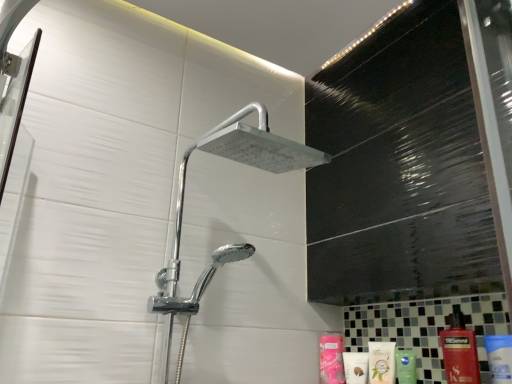
Question: Is white glossy mouthwash at lower right next to pink matte lotion at lower center, the second toiletry in the front-to-back sequence?

Choices:
 (A) no
 (B) yes

Answer: (A)

Question: Considering the relative sizes of white glossy mouthwash at lower right and pink matte lotion at lower center, the second toiletry in the front-to-back sequence, in the image provided, is white glossy mouthwash at lower right thinner than pink matte lotion at lower center, the second toiletry in the front-to-back sequence,?

Choices:
 (A) yes
 (B) no

Answer: (B)

Question: From the image's perspective, is white glossy mouthwash at lower right located beneath pink matte lotion at lower center, the second toiletry in the front-to-back sequence?

Choices:
 (A) yes
 (B) no

Answer: (B)

Question: Is white glossy mouthwash at lower right positioned with its back to pink matte lotion at lower center, the second toiletry in the front-to-back sequence?

Choices:
 (A) yes
 (B) no

Answer: (B)

Question: Is white glossy mouthwash at lower right positioned beyond the bounds of pink matte lotion at lower center, the second toiletry in the front-to-back sequence?

Choices:
 (A) no
 (B) yes

Answer: (B)

Question: Is white glossy mouthwash at lower right to the left or to the right of pink matte lotion at lower center, the first toiletry in the back-to-front sequence, in the image?

Choices:
 (A) left
 (B) right

Answer: (B)

Question: From the image's perspective, is white glossy mouthwash at lower right positioned above or below pink matte lotion at lower center, the second toiletry in the front-to-back sequence?

Choices:
 (A) below
 (B) above

Answer: (B)

Question: Is white glossy mouthwash at lower right wider or thinner than pink matte lotion at lower center, the first toiletry in the back-to-front sequence?

Choices:
 (A) thin
 (B) wide

Answer: (B)

Question: From a real-world perspective, is white glossy mouthwash at lower right physically located above or below pink matte lotion at lower center, the first toiletry in the back-to-front sequence?

Choices:
 (A) below
 (B) above

Answer: (A)

Question: Considering the positions of pink matte lotion at lower center, the first toiletry in the back-to-front sequence, and white matte lotion at lower right, placed as the second toiletry when sorted from back to front, in the image, is pink matte lotion at lower center, the first toiletry in the back-to-front sequence, taller or shorter than white matte lotion at lower right, placed as the second toiletry when sorted from back to front,?

Choices:
 (A) short
 (B) tall

Answer: (B)

Question: In terms of width, does pink matte lotion at lower center, the first toiletry in the back-to-front sequence, look wider or thinner when compared to white matte lotion at lower right, the 1th toiletry when ordered from front to back?

Choices:
 (A) thin
 (B) wide

Answer: (A)

Question: Visually, is pink matte lotion at lower center, the second toiletry in the front-to-back sequence, positioned to the left or to the right of white matte lotion at lower right, placed as the second toiletry when sorted from back to front?

Choices:
 (A) left
 (B) right

Answer: (A)

Question: From a real-world perspective, is pink matte lotion at lower center, the first toiletry in the back-to-front sequence, physically located above or below white matte lotion at lower right, the 1th toiletry when ordered from front to back?

Choices:
 (A) below
 (B) above

Answer: (B)

Question: Is pink matte lotion at lower center, the second toiletry in the front-to-back sequence, wider or thinner than white glossy mouthwash at lower right?

Choices:
 (A) wide
 (B) thin

Answer: (B)

Question: Considering the positions of pink matte lotion at lower center, the first toiletry in the back-to-front sequence, and white glossy mouthwash at lower right in the image, is pink matte lotion at lower center, the first toiletry in the back-to-front sequence, taller or shorter than white glossy mouthwash at lower right?

Choices:
 (A) short
 (B) tall

Answer: (B)